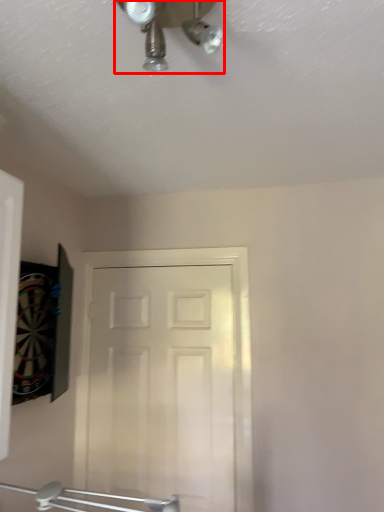
Question: Where is mechanical fan (annotated by the red box) located in relation to door in the image?

Choices:
 (A) left
 (B) right

Answer: (B)